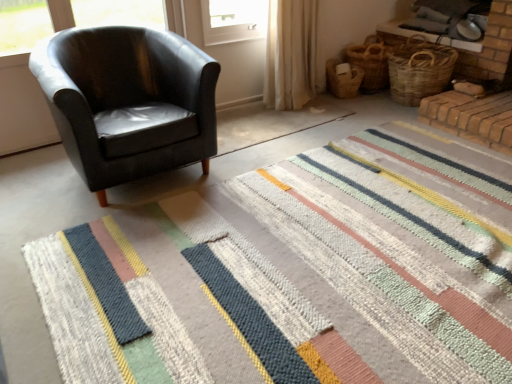
Question: In the image, is woven straw basket at right, acting as the third basket starting from the right, on the left side or the right side of beige fabric curtain at upper center?

Choices:
 (A) left
 (B) right

Answer: (B)

Question: From the image's perspective, is woven straw basket at right, which is counted as the 1th basket, starting from the left, located above or below beige fabric curtain at upper center?

Choices:
 (A) above
 (B) below

Answer: (B)

Question: Which of these objects is positioned closest to the woven brown basket at upper right, the 1th basket in the right-to-left sequence?

Choices:
 (A) woven brown basket at upper right, arranged as the 2th basket when viewed from the left
 (B) striped woolen rug at center
 (C) matte black armchair at left
 (D) beige fabric curtain at upper center
 (E) woven straw basket at right, acting as the third basket starting from the right

Answer: (A)

Question: Estimate the real-world distances between objects in this image. Which object is farther from the beige fabric curtain at upper center?

Choices:
 (A) woven brown basket at upper right, the 1th basket in the right-to-left sequence
 (B) woven straw basket at right, which is counted as the 1th basket, starting from the left
 (C) matte black armchair at left
 (D) woven brown basket at upper right, arranged as the 2th basket when viewed from the left
 (E) striped woolen rug at center

Answer: (E)